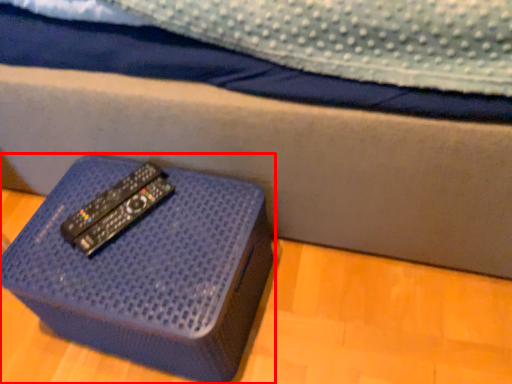
Question: From the image's perspective, where is furniture (annotated by the red box) located relative to remote?

Choices:
 (A) above
 (B) below

Answer: (B)